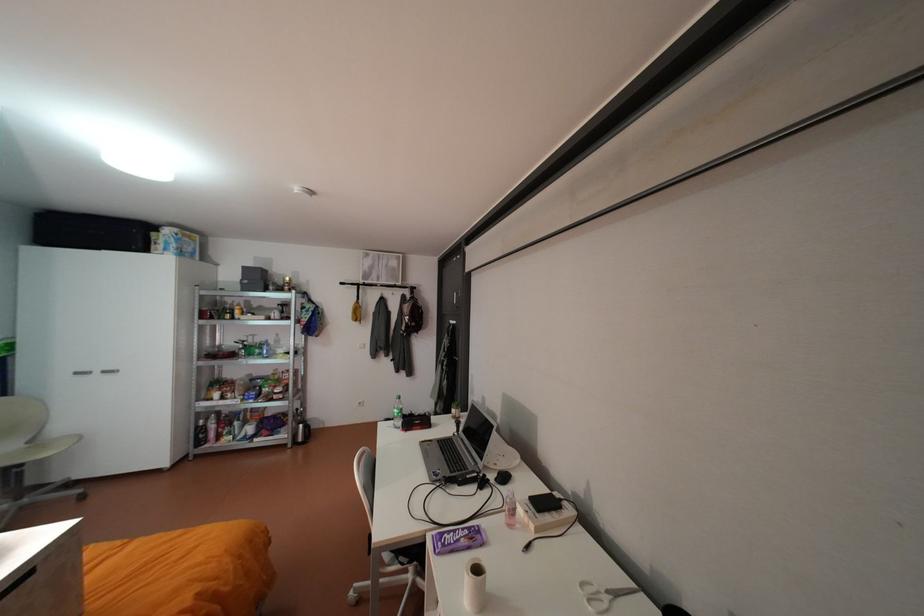
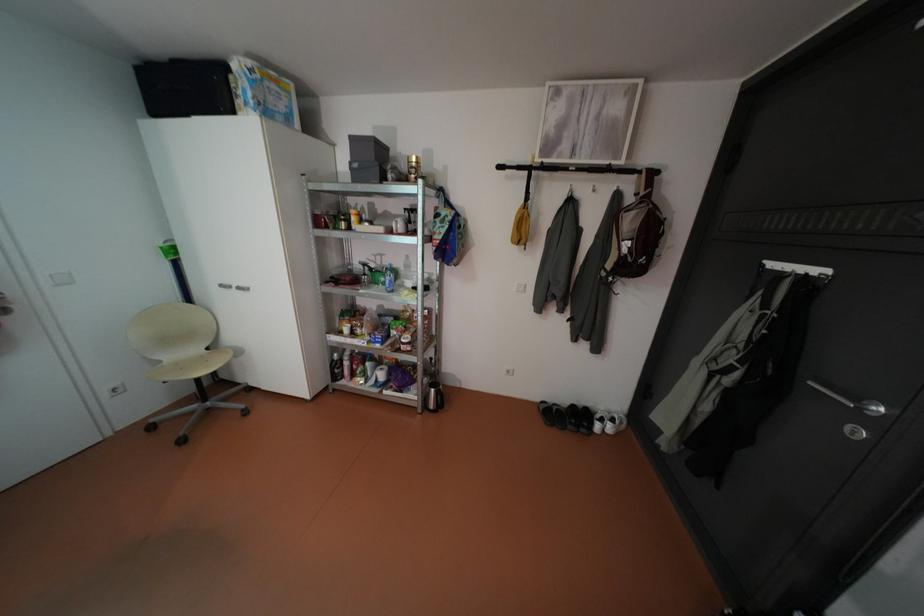
Find the pixel in the second image that matches (x=114, y=371) in the first image.

(248, 286)